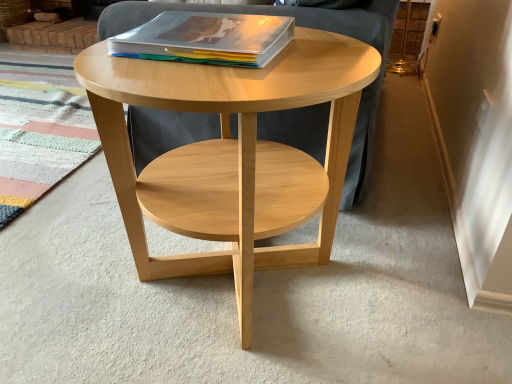
Where is `matte plastic magazine at center`? This screenshot has height=384, width=512. matte plastic magazine at center is located at coordinates (206, 39).

This screenshot has height=384, width=512. What do you see at coordinates (206, 39) in the screenshot?
I see `matte plastic magazine at center` at bounding box center [206, 39].

What is the approximate height of matte plastic magazine at center?

matte plastic magazine at center is 2.34 inches in height.

Identify the location of natural wood coffee table at center. The image size is (512, 384). (231, 156).

What do you see at coordinates (231, 156) in the screenshot?
I see `natural wood coffee table at center` at bounding box center [231, 156].

Find the location of a particular element. matte plastic magazine at center is located at coordinates (206, 39).

Would you say matte plastic magazine at center is to the left or to the right of natural wood coffee table at center in the picture?

In the image, matte plastic magazine at center appears on the left side of natural wood coffee table at center.

Which object is further away from the camera, matte plastic magazine at center or natural wood coffee table at center?

matte plastic magazine at center is behind.

Is point (268, 17) closer or farther from the camera than point (93, 84)?

Clearly, point (268, 17) is more distant from the camera than point (93, 84).

From the picture: From the image's perspective, is matte plastic magazine at center above natural wood coffee table at center?

Yes.

From a real-world perspective, between matte plastic magazine at center and natural wood coffee table at center, who is vertically lower?

natural wood coffee table at center, from a real-world perspective.

Which of these two, matte plastic magazine at center or natural wood coffee table at center, is wider?

With larger width is natural wood coffee table at center.

Considering the relative sizes of matte plastic magazine at center and natural wood coffee table at center in the image provided, is matte plastic magazine at center shorter than natural wood coffee table at center?

Yes, matte plastic magazine at center is shorter than natural wood coffee table at center.

Considering the relative sizes of matte plastic magazine at center and natural wood coffee table at center in the image provided, is matte plastic magazine at center smaller than natural wood coffee table at center?

Yes, matte plastic magazine at center is smaller than natural wood coffee table at center.

Is natural wood coffee table at center located within matte plastic magazine at center?

That's incorrect, natural wood coffee table at center is not inside matte plastic magazine at center.

Would you consider matte plastic magazine at center to be distant from natural wood coffee table at center?

Actually, matte plastic magazine at center and natural wood coffee table at center are a little close together.

Is matte plastic magazine at center facing away from natural wood coffee table at center?

That's not correct — matte plastic magazine at center is not looking away from natural wood coffee table at center.

From the picture: What's the angular difference between matte plastic magazine at center and natural wood coffee table at center's facing directions?

There is a 2.71-degree angle between the facing directions of matte plastic magazine at center and natural wood coffee table at center.

Measure the distance from matte plastic magazine at center to natural wood coffee table at center.

8.37 inches.

Find the location of a particular element. The width and height of the screenshot is (512, 384). coffee table below the matte plastic magazine at center (from the image's perspective) is located at coordinates (231, 156).

Based on the photo, based on their positions, is natural wood coffee table at center located to the left or right of matte plastic magazine at center?

In the image, natural wood coffee table at center appears on the right side of matte plastic magazine at center.

Considering their positions, is natural wood coffee table at center located in front of or behind matte plastic magazine at center?

Clearly, natural wood coffee table at center is in front of matte plastic magazine at center.

Is point (131, 70) farther from viewer compared to point (220, 53)?

No, (131, 70) is closer to viewer.

From the image's perspective, who appears lower, natural wood coffee table at center or matte plastic magazine at center?

natural wood coffee table at center is shown below in the image.

From a real-world perspective, is natural wood coffee table at center physically above matte plastic magazine at center?

No.

Considering the sizes of objects natural wood coffee table at center and matte plastic magazine at center in the image provided, who is wider, natural wood coffee table at center or matte plastic magazine at center?

With larger width is natural wood coffee table at center.

From their relative heights in the image, would you say natural wood coffee table at center is taller or shorter than matte plastic magazine at center?

natural wood coffee table at center is taller than matte plastic magazine at center.

Can you confirm if natural wood coffee table at center is bigger than matte plastic magazine at center?

Indeed, natural wood coffee table at center has a larger size compared to matte plastic magazine at center.

Is natural wood coffee table at center not within matte plastic magazine at center?

natural wood coffee table at center is positioned outside matte plastic magazine at center.

Is natural wood coffee table at center positioned far away from matte plastic magazine at center?

No, there isn't a large distance between natural wood coffee table at center and matte plastic magazine at center.

From the picture: Is natural wood coffee table at center turned away from matte plastic magazine at center?

No.

What's the angular difference between natural wood coffee table at center and matte plastic magazine at center's facing directions?

2.71 degrees.

The height and width of the screenshot is (384, 512). What are the coordinates of `coffee table below the matte plastic magazine at center (from the image's perspective)` in the screenshot? It's located at (231, 156).

This screenshot has height=384, width=512. I want to click on coffee table below the matte plastic magazine at center (from a real-world perspective), so click(x=231, y=156).

The height and width of the screenshot is (384, 512). I want to click on coffee table that is in front of the matte plastic magazine at center, so click(x=231, y=156).